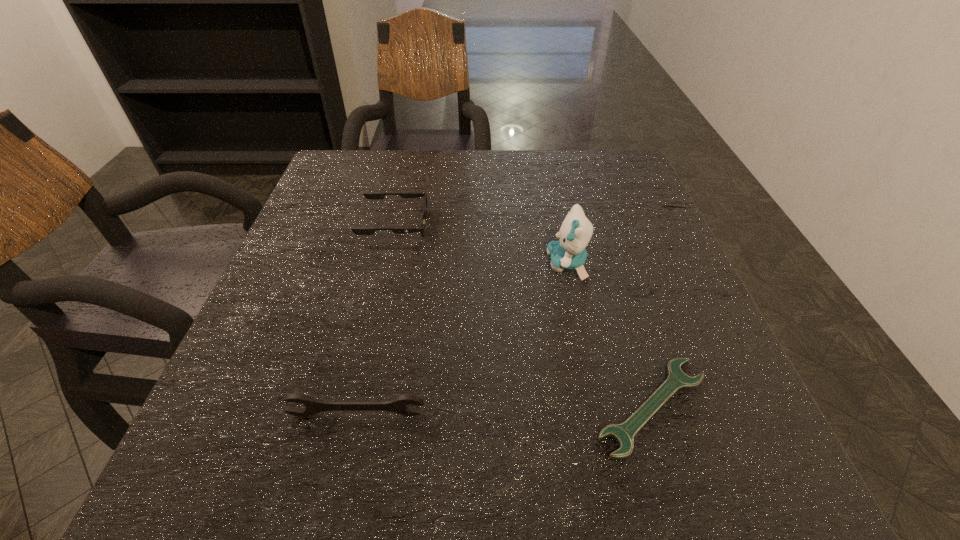
The image size is (960, 540). I want to click on vacant space at the left edge, so click(350, 253).

In the image, there is a desktop. Where is `vacant space at the right edge`? The height and width of the screenshot is (540, 960). vacant space at the right edge is located at coordinates (612, 264).

In the image, there is a desktop. At what (x,y) coordinates should I click in order to perform the action: click on vacant region at the far right corner. Please return your answer as a coordinate pair (x, y). Looking at the image, I should click on (589, 160).

Image resolution: width=960 pixels, height=540 pixels. What are the coordinates of `free space that is in between the sunglasses and the left wrench` in the screenshot? It's located at (375, 320).

Find the location of a particular element. vacant space in between the sunglasses and the third shortest object is located at coordinates (375, 320).

Find the location of a particular element. vacant area that lies between the farthest object and the right wrench is located at coordinates (523, 315).

Locate an element on the screen. The width and height of the screenshot is (960, 540). free space between the sunglasses and the taller wrench is located at coordinates (375, 320).

Identify the location of free spot between the sunglasses and the tallest object. (481, 245).

Locate an element on the screen. The image size is (960, 540). free spot between the right wrench and the left wrench is located at coordinates (504, 410).

You are a GUI agent. You are given a task and a screenshot of the screen. Output one action in this format:
    pyautogui.click(x=<x>, y=<y>)
    Task: Click on the vacant area between the shortest object and the farthest object
    The height and width of the screenshot is (540, 960).
    Given the screenshot: What is the action you would take?
    pyautogui.click(x=523, y=315)